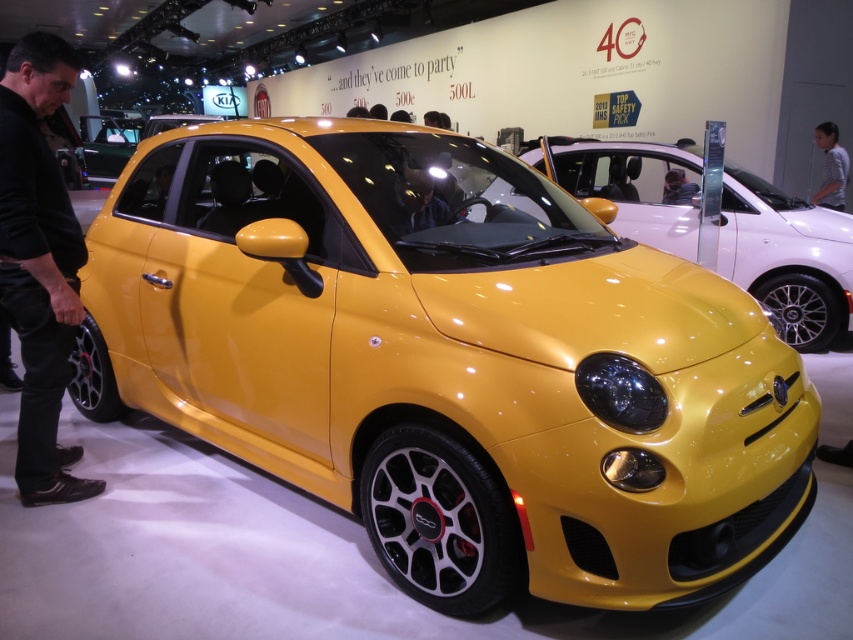
You are a photographer at the auto show and want to capture the glossy yellow car at center and the gray striped shirt at center in a single frame. Considering their heights, which object should you focus on first to ensure both are in focus?

The glossy yellow car at center is taller than the gray striped shirt at center, so focus on the glossy yellow car at center first to ensure both are in focus.

You are a photographer at the auto show. You need to capture a photo that includes both the glossy yellow car at center and the black leather pants at lower left. Based on their positions, where should you stand to ensure both are in the frame?

The glossy yellow car at center is positioned on the right side of black leather pants at lower left. To include both in the frame, you should stand to the left side of the black leather pants at lower left so that the glossy yellow car at center is on the right and the black leather pants at lower left are on the left in the photo.

You are at an auto show and want to take a photo of the car. You notice two points on the car, one at point (36, 317) and another at point (821, 205). Which point will appear larger in your photo?

The point at (36, 317) will appear larger in the photo because it is closer to the viewer than the point at (821, 205).